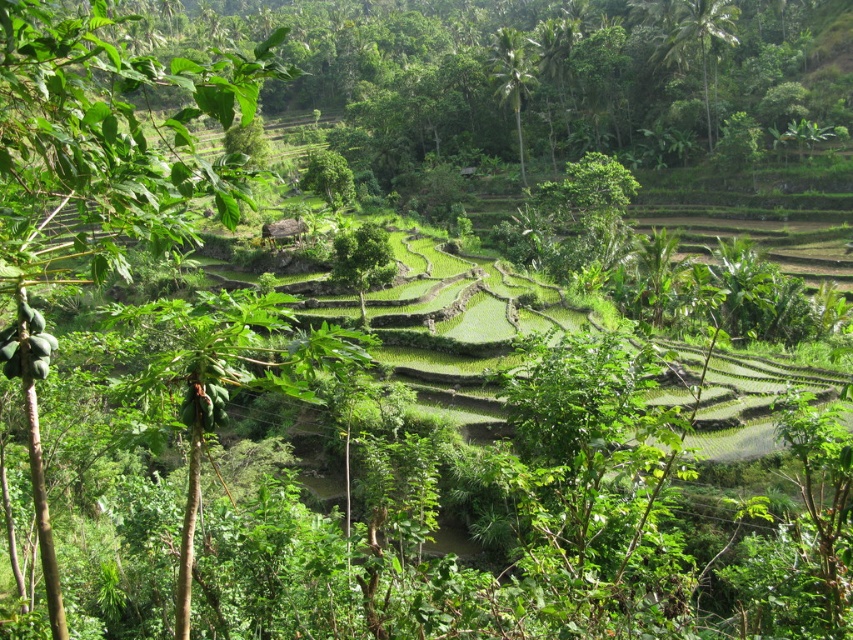
Where is `green leafy tree at upper right`? This screenshot has width=853, height=640. green leafy tree at upper right is located at coordinates (699, 38).

Find the location of a particular element. The height and width of the screenshot is (640, 853). green leafy tree at upper right is located at coordinates (699, 38).

At what (x,y) coordinates should I click in order to perform the action: click on green leafy tree at upper right. Please return your answer as a coordinate pair (x, y). This screenshot has width=853, height=640. Looking at the image, I should click on (699, 38).

Is point (712, 28) less distant than point (363, 323)?

That is False.

Between point (726, 35) and point (370, 256), which one is positioned behind?

The point (726, 35) is more distant.

In order to click on green leafy tree at upper right in this screenshot , I will do `click(699, 38)`.

Locate an element on the screen. This screenshot has height=640, width=853. green leafy tree at upper right is located at coordinates (699, 38).

Does green leafy tree at center have a lesser width compared to green leafy palm at upper center?

Indeed, green leafy tree at center has a lesser width compared to green leafy palm at upper center.

Between green leafy tree at center and green leafy palm at upper center, which one is positioned higher?

green leafy palm at upper center is higher up.

What do you see at coordinates (363, 260) in the screenshot? Image resolution: width=853 pixels, height=640 pixels. I see `green leafy tree at center` at bounding box center [363, 260].

Find the location of a particular element. This screenshot has height=640, width=853. green leafy tree at center is located at coordinates (363, 260).